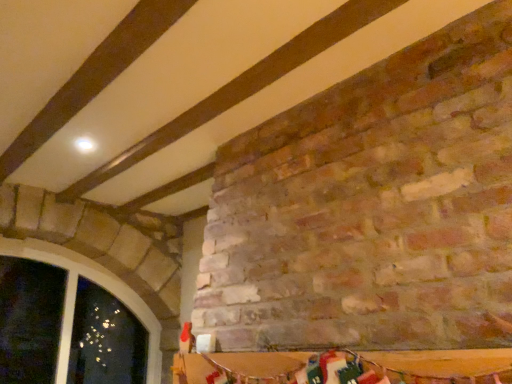
What do you see at coordinates (346, 367) in the screenshot? The height and width of the screenshot is (384, 512). I see `wooden table at lower center` at bounding box center [346, 367].

At what (x,y) coordinates should I click in order to perform the action: click on wooden table at lower center. Please return your answer as a coordinate pair (x, y). The image size is (512, 384). Looking at the image, I should click on point(346,367).

Image resolution: width=512 pixels, height=384 pixels. Identify the location of matte stone window at lower left. (75, 296).

What do you see at coordinates (75, 296) in the screenshot? The height and width of the screenshot is (384, 512). I see `matte stone window at lower left` at bounding box center [75, 296].

This screenshot has height=384, width=512. I want to click on wooden table at lower center, so click(x=346, y=367).

Can you confirm if wooden table at lower center is positioned to the left of matte stone window at lower left?

No.

Which object is more forward, wooden table at lower center or matte stone window at lower left?

wooden table at lower center is more forward.

Which point is more forward, (x=395, y=369) or (x=51, y=248)?

Positioned in front is point (x=395, y=369).

Based on the photo, from the image's perspective, is wooden table at lower center over matte stone window at lower left?

Yes, from the image's perspective, wooden table at lower center is on top of matte stone window at lower left.

From a real-world perspective, is wooden table at lower center positioned under matte stone window at lower left based on gravity?

Yes, from a real-world perspective, wooden table at lower center is beneath matte stone window at lower left.

Considering the sizes of objects wooden table at lower center and matte stone window at lower left in the image provided, who is thinner, wooden table at lower center or matte stone window at lower left?

Thinner between the two is wooden table at lower center.

Can you confirm if wooden table at lower center is shorter than matte stone window at lower left?

Correct, wooden table at lower center is not as tall as matte stone window at lower left.

Consider the image. Who is smaller, wooden table at lower center or matte stone window at lower left?

wooden table at lower center is smaller.

Consider the image. Is matte stone window at lower left located within wooden table at lower center?

No, matte stone window at lower left is not inside wooden table at lower center.

Are wooden table at lower center and matte stone window at lower left making contact?

They are not placed beside each other.

Could you tell me if wooden table at lower center is facing matte stone window at lower left?

No, wooden table at lower center is not facing towards matte stone window at lower left.

Can you tell me how much wooden table at lower center and matte stone window at lower left differ in facing direction?

87.9 degrees.

Identify the location of window that is on the left side of wooden table at lower center. This screenshot has height=384, width=512. (75, 296).

Which object is positioned more to the left, matte stone window at lower left or wooden table at lower center?

matte stone window at lower left.

Is matte stone window at lower left in front of wooden table at lower center?

No, matte stone window at lower left is further to the viewer.

Is point (126, 287) closer or farther from the camera than point (187, 363)?

Point (126, 287).

From the image's perspective, is matte stone window at lower left beneath wooden table at lower center?

Correct, matte stone window at lower left appears lower than wooden table at lower center in the image.

From a real-world perspective, who is located lower, matte stone window at lower left or wooden table at lower center?

In real-world perspective, wooden table at lower center is lower.

From the picture: Considering the sizes of objects matte stone window at lower left and wooden table at lower center in the image provided, who is wider, matte stone window at lower left or wooden table at lower center?

With larger width is matte stone window at lower left.

Considering the relative sizes of matte stone window at lower left and wooden table at lower center in the image provided, is matte stone window at lower left taller than wooden table at lower center?

Correct, matte stone window at lower left is much taller as wooden table at lower center.

Looking at the image, does matte stone window at lower left seem bigger or smaller compared to wooden table at lower center?

Clearly, matte stone window at lower left is larger in size than wooden table at lower center.

Would you say matte stone window at lower left contains wooden table at lower center?

No, wooden table at lower center is not a part of matte stone window at lower left.

Are matte stone window at lower left and wooden table at lower center located far from each other?

Yes.

Based on the photo, is wooden table at lower center at the back of matte stone window at lower left?

matte stone window at lower left is not turned away from wooden table at lower center.

You are a GUI agent. You are given a task and a screenshot of the screen. Output one action in this format:
    pyautogui.click(x=<x>, y=<y>)
    Task: Click on the table that is in front of the matte stone window at lower left
    
    Given the screenshot: What is the action you would take?
    pyautogui.click(x=346, y=367)

You are a GUI agent. You are given a task and a screenshot of the screen. Output one action in this format:
    pyautogui.click(x=<x>, y=<y>)
    Task: Click on the window behind the wooden table at lower center
    The height and width of the screenshot is (384, 512).
    Given the screenshot: What is the action you would take?
    pyautogui.click(x=75, y=296)

Locate an element on the screen. Image resolution: width=512 pixels, height=384 pixels. window on the left of wooden table at lower center is located at coordinates (75, 296).